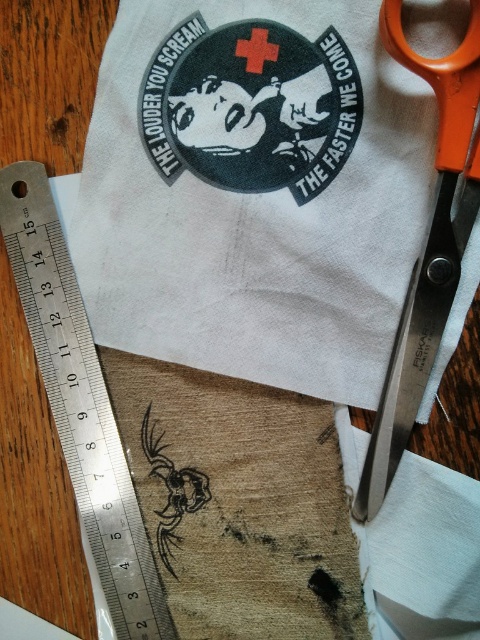
You are a tailor working on a wooden table and need to cut a 10 cm strip from the white cotton cloth at center. You have the silver metallic ruler at left to measure. Can the ruler measure the entire length of the cloth?

The white cotton cloth at center is larger in size than the silver metallic ruler at left, so the ruler cannot measure its entire length since it is shorter than the cloth.

You need to cut the fabric along the edge of the silver metallic ruler at left. Can the orange plastic scissors at right reach the ruler to make the cut?

The silver metallic ruler at left might be wider than orange plastic scissors at right, so the scissors may not be able to reach the ruler to make the cut properly.

You are a tailor working on a project and need to measure the distance between the silver metallic ruler at left and the viewer. Can you determine if the distance is more than 2 feet?

The silver metallic ruler at left and viewer are 27.77 inches apart, which is more than 2 feet since 2 feet equals 24 inches. Therefore, the distance is more than 2 feet.